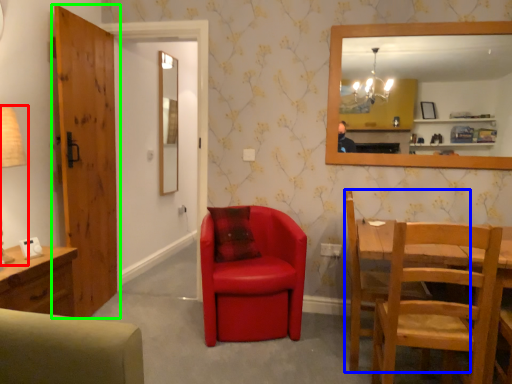
Question: Considering the real-world distances, which object is farthest from table lamp (highlighted by a red box)? chair (highlighted by a blue box) or door (highlighted by a green box)?

Choices:
 (A) chair
 (B) door

Answer: (A)